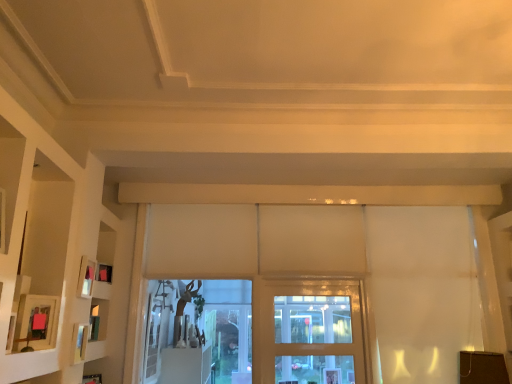
Question: From a real-world perspective, is matte pink picture frame at left, acting as the 3th picture frame starting from the back, on white matte shelf at left?

Choices:
 (A) yes
 (B) no

Answer: (B)

Question: Can you confirm if matte pink picture frame at left, acting as the 3th picture frame starting from the back, is bigger than white matte shelf at left?

Choices:
 (A) yes
 (B) no

Answer: (B)

Question: From a real-world perspective, is matte pink picture frame at left, the first picture frame positioned from the front, physically below white matte shelf at left?

Choices:
 (A) yes
 (B) no

Answer: (A)

Question: Is matte pink picture frame at left, acting as the 3th picture frame starting from the back, not inside white matte shelf at left?

Choices:
 (A) no
 (B) yes

Answer: (A)

Question: Is matte pink picture frame at left, acting as the 3th picture frame starting from the back, smaller than white matte shelf at left?

Choices:
 (A) no
 (B) yes

Answer: (B)

Question: In terms of size, does matte pink picture frame at left, the first picture frame positioned from the front, appear bigger or smaller than white matte shelf at left?

Choices:
 (A) big
 (B) small

Answer: (B)

Question: From a real-world perspective, is matte pink picture frame at left, the first picture frame positioned from the front, physically located above or below white matte shelf at left?

Choices:
 (A) below
 (B) above

Answer: (A)

Question: Considering the positions of point (29, 349) and point (61, 304), is point (29, 349) closer or farther from the camera than point (61, 304)?

Choices:
 (A) closer
 (B) farther

Answer: (A)

Question: From the image's perspective, relative to white matte shelf at left, is matte pink picture frame at left, the first picture frame positioned from the front, above or below?

Choices:
 (A) above
 (B) below

Answer: (B)

Question: From a real-world perspective, is matte pink picture frame at left, acting as the 3th picture frame starting from the back, above or below matte wooden picture frame at left, the second picture frame from the back?

Choices:
 (A) below
 (B) above

Answer: (A)

Question: Choose the correct answer: Is matte pink picture frame at left, acting as the 3th picture frame starting from the back, inside matte wooden picture frame at left, the second picture frame from the back, or outside it?

Choices:
 (A) inside
 (B) outside

Answer: (B)

Question: In the image, is matte pink picture frame at left, acting as the 3th picture frame starting from the back, positioned in front of or behind matte wooden picture frame at left, the 2th picture frame from the front?

Choices:
 (A) behind
 (B) front

Answer: (B)

Question: From the image's perspective, is matte pink picture frame at left, the first picture frame positioned from the front, above or below matte wooden picture frame at left, the second picture frame from the back?

Choices:
 (A) below
 (B) above

Answer: (A)

Question: From their relative heights in the image, would you say matte black picture frame at left, arranged as the third picture frame when viewed from the front, is taller or shorter than white matte shelf at left?

Choices:
 (A) tall
 (B) short

Answer: (B)

Question: Is point (111, 274) positioned closer to the camera than point (40, 369)?

Choices:
 (A) farther
 (B) closer

Answer: (A)